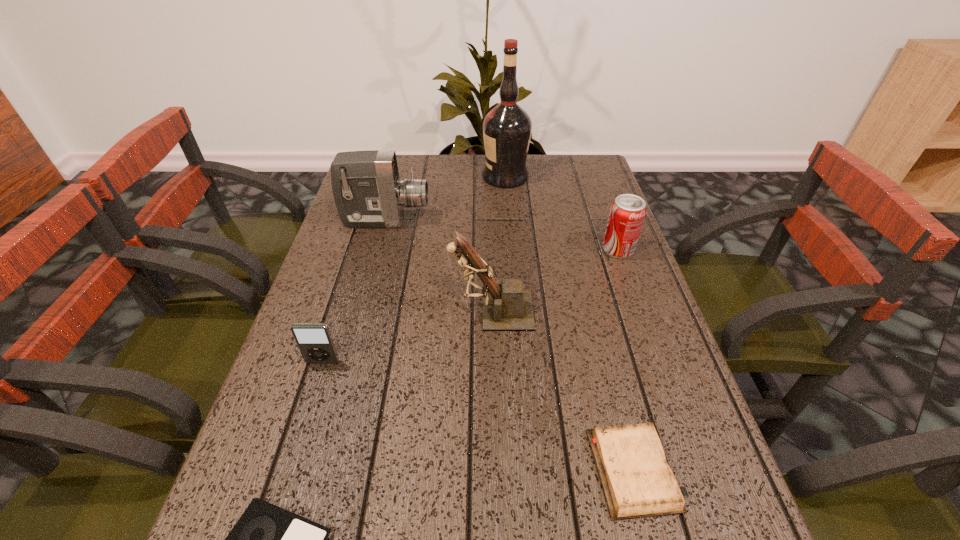
Image resolution: width=960 pixels, height=540 pixels. In order to click on free space between the tallest object and the camcorder in this screenshot , I will do `click(445, 199)`.

This screenshot has width=960, height=540. Find the location of `empty location between the diary and the fourth farthest object`. empty location between the diary and the fourth farthest object is located at coordinates (564, 390).

This screenshot has height=540, width=960. I want to click on vacant space that's between the second shortest object and the second farthest object, so click(511, 345).

Where is `free space between the farthest object and the sixth nearest object`? The width and height of the screenshot is (960, 540). free space between the farthest object and the sixth nearest object is located at coordinates (445, 199).

I want to click on empty space that is in between the second shortest object and the second farthest object, so click(x=511, y=345).

I want to click on vacant region between the second shortest object and the fifth nearest object, so click(x=626, y=360).

Choose which object is the fourth nearest neighbor to the shortest object. Please provide its 2D coordinates. Your answer should be formatted as a tuple, i.e. [(x, y)], where the tuple contains the x and y coordinates of a point satisfying the conditions above.

[(368, 193)]

This screenshot has height=540, width=960. What are the coordinates of `the closest object to the camcorder` in the screenshot? It's located at (507, 128).

Identify the location of vacant space that satisfies the following two spatial constraints: 1. on the back side of the soda can; 2. on the surface of the tallest object. Image resolution: width=960 pixels, height=540 pixels. (591, 177).

Image resolution: width=960 pixels, height=540 pixels. I want to click on vacant area in the image that satisfies the following two spatial constraints: 1. at the front of the soda can, highlighting the lens; 2. on the right side of the second farthest object, so click(378, 249).